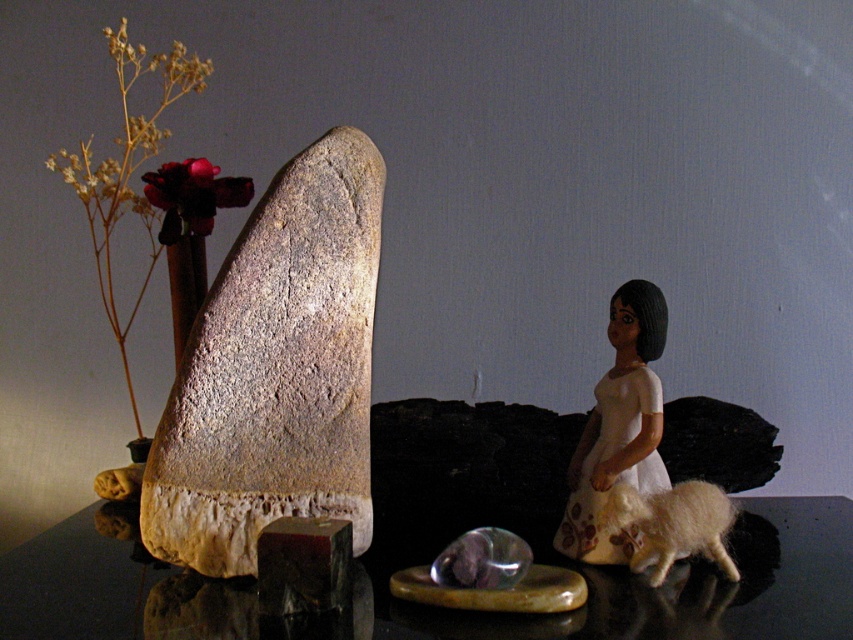
You are a fashion designer observing the image. You need to decide which item is taller between the white matte dress at center right and the velvety crimson bloom at upper left. Which one is taller?

The white matte dress at center right has a greater height compared to the velvety crimson bloom at upper left, so the white matte dress at center right is taller.

You are standing 5 feet away from the reflective surface where the velvety crimson bloom at upper left is placed. Can you comfortably reach it without moving closer?

The velvety crimson bloom at upper left is 4.24 feet away from the viewer. Since you are standing 5 feet away, you are slightly farther than the bloom. To reach it comfortably, you would need to move closer to reduce the distance between yourself and the bloom.

You are arranging a display and need to place a decorative item on the black glossy table at center. Considering the size of the rusty stone rock at left, will it fit comfortably on the table without overcrowding?

The rusty stone rock at left has a smaller size compared to the black glossy table at center, so it should fit comfortably without overcrowding.